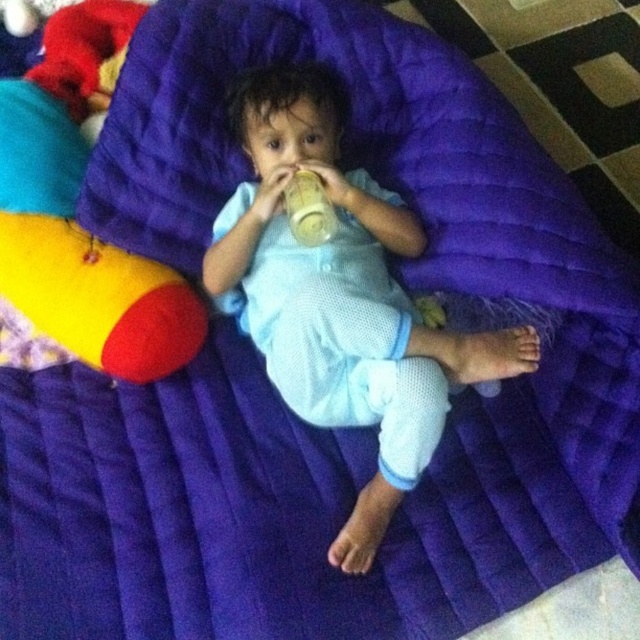
You are a photographer trying to capture the translucent plastic bottle at center without the light blue fabric toddler at center blocking it. What should you do?

Move the light blue fabric toddler at center away from the translucent plastic bottle at center since the toddler is currently in front of the bottle, blocking it.

A photographer wants to take a closeup shot of the light blue fabric toddler at center without moving the camera. What adjustment should they make to the camera lens to focus properly?

The light blue fabric toddler at center is 99.32 centimeters away from the camera. To focus properly on the subject without moving the camera, the photographer should adjust the lens to a focal length that corresponds to this distance, ensuring sharp focus on the toddler.

You are a photographer setting up a shoot in this room. You need to place a small tripod between the light blue fabric toddler at center and the translucent plastic bottle at center. Based on their positions, which object should the tripod be closer to?

The light blue fabric toddler at center is positioned on the right side of the translucent plastic bottle at center. Therefore, the tripod should be placed closer to the translucent plastic bottle at center to be between them.